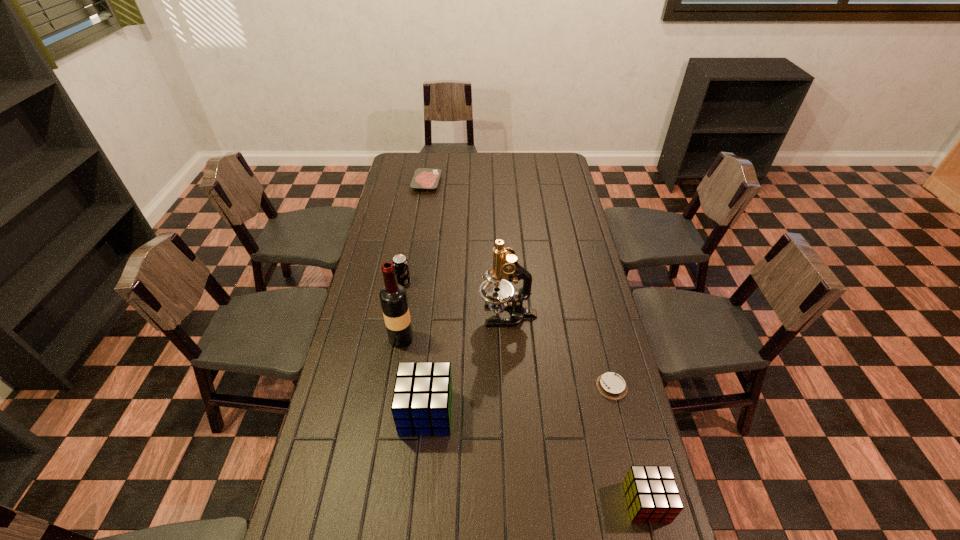
Image resolution: width=960 pixels, height=540 pixels. I want to click on vacant area situated 0.240m on the front of the taller cube, so click(x=415, y=531).

This screenshot has height=540, width=960. I want to click on free spot located 0.360m on the back of the nearest object, so click(612, 367).

Locate an element on the screen. The image size is (960, 540). vacant region located on the front of the farthest object is located at coordinates (423, 204).

You are a GUI agent. You are given a task and a screenshot of the screen. Output one action in this format:
    pyautogui.click(x=<x>, y=<y>)
    Task: Click on the vacant space situated at the eyepiece of the fifth object from left to right
    The image size is (960, 540).
    Given the screenshot: What is the action you would take?
    tap(372, 315)

This screenshot has height=540, width=960. Find the location of `free point located 0.110m at the eyepiece of the fifth object from left to right`. free point located 0.110m at the eyepiece of the fifth object from left to right is located at coordinates (447, 315).

Identify the location of free region located at the eyepiece of the fifth object from left to right. Image resolution: width=960 pixels, height=540 pixels. (414, 315).

This screenshot has width=960, height=540. Identify the location of vacant space located on the left of the fourth tallest object. (374, 283).

At what (x,y) coordinates should I click in order to perform the action: click on vacant space located on the front of the chocolate cake. Please return your answer as a coordinate pair (x, y). The image size is (960, 540). Looking at the image, I should click on (642, 510).

This screenshot has height=540, width=960. I want to click on vacant space situated 0.150m on the right of the wine bottle, so click(x=457, y=339).

Find the location of `object situated at the far edge`. object situated at the far edge is located at coordinates [423, 178].